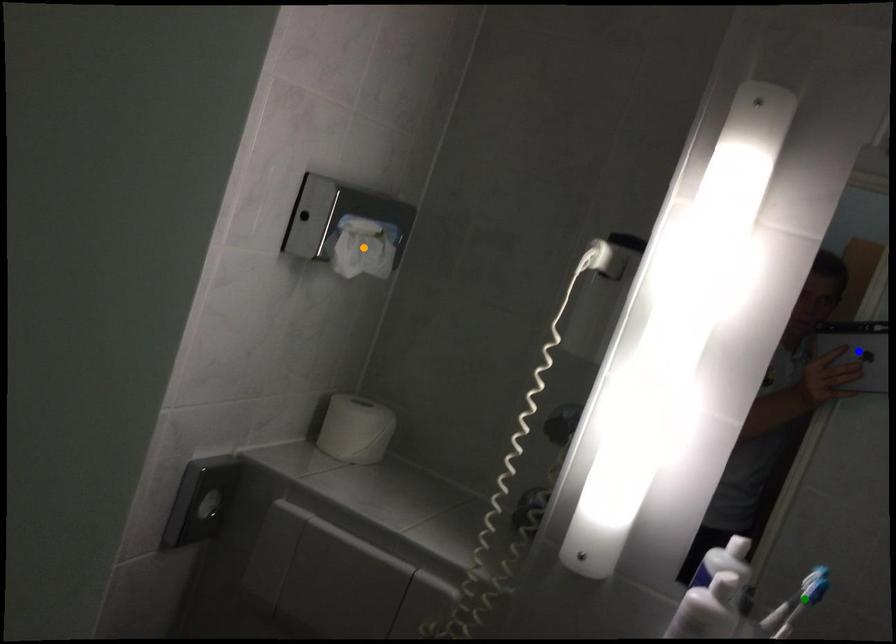
Order these from nearest to farthest:
orange point, green point, blue point

blue point
orange point
green point